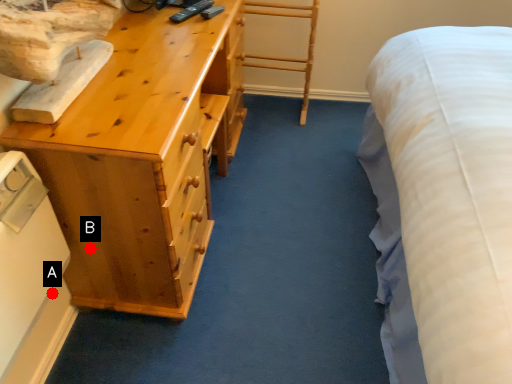
Question: Two points are circled on the image, labeled by A and B beside each circle. Which point is farther from the camera taking this photo?

Choices:
 (A) A is further
 (B) B is further

Answer: (A)